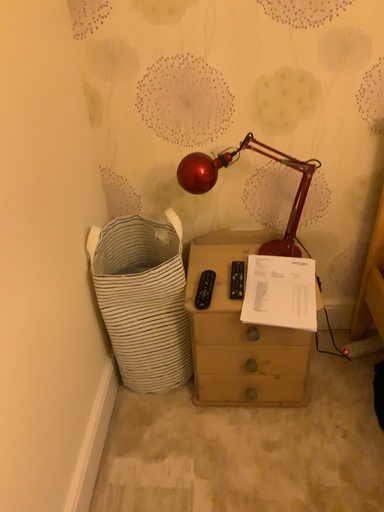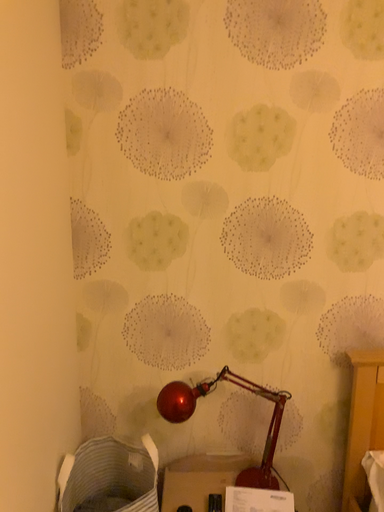
Question: Which way did the camera rotate in the video?

Choices:
 (A) rotated downward
 (B) rotated upward

Answer: (B)